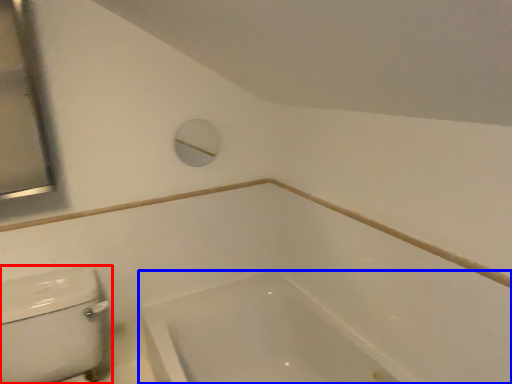
Question: Which object appears farthest to the camera in this image, porcelain (highlighted by a red box) or bathtub (highlighted by a blue box)?

Choices:
 (A) porcelain
 (B) bathtub

Answer: (B)